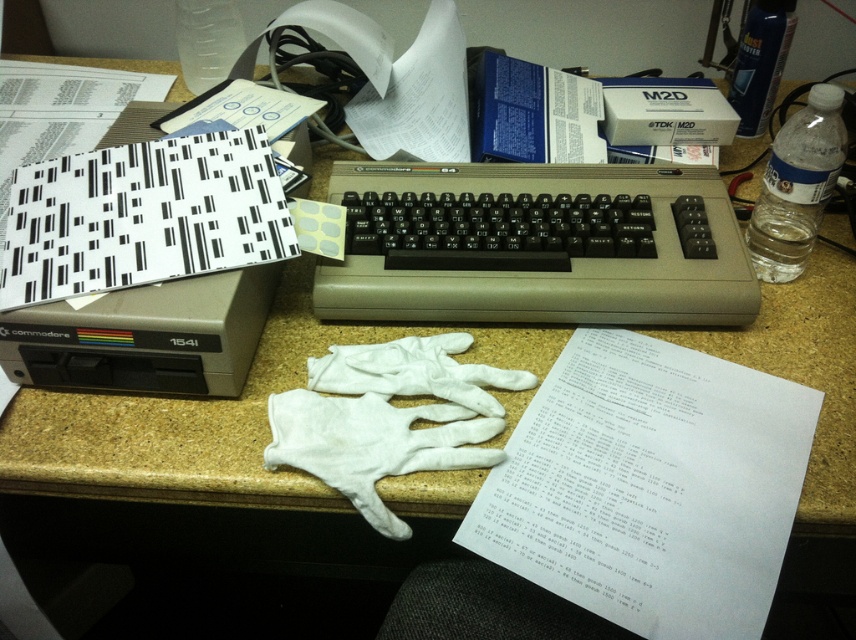
Between point (450, 502) and point (375, 308), which one is positioned in front?

Point (450, 502) is in front.

Who is positioned more to the left, beige laminate counter top at center or black plastic keyboard at center?

black plastic keyboard at center

The image size is (856, 640). What do you see at coordinates (182, 424) in the screenshot?
I see `beige laminate counter top at center` at bounding box center [182, 424].

You are a GUI agent. You are given a task and a screenshot of the screen. Output one action in this format:
    pyautogui.click(x=<x>, y=<y>)
    Task: Click on the beige laminate counter top at center
    The width and height of the screenshot is (856, 640).
    Given the screenshot: What is the action you would take?
    pyautogui.click(x=182, y=424)

Does white paper at center have a lesser height compared to beige laminate counter top at center?

Yes, white paper at center is shorter than beige laminate counter top at center.

Is point (705, 506) positioned behind point (251, 500)?

No, it is in front of (251, 500).

This screenshot has width=856, height=640. What do you see at coordinates (651, 486) in the screenshot? I see `white paper at center` at bounding box center [651, 486].

This screenshot has width=856, height=640. I want to click on white paper at center, so click(x=651, y=486).

Does point (750, 442) lie in front of point (485, 177)?

That is True.

Is the position of white paper at center less distant than that of black plastic keyboard at center?

Yes.

I want to click on white paper at center, so click(651, 486).